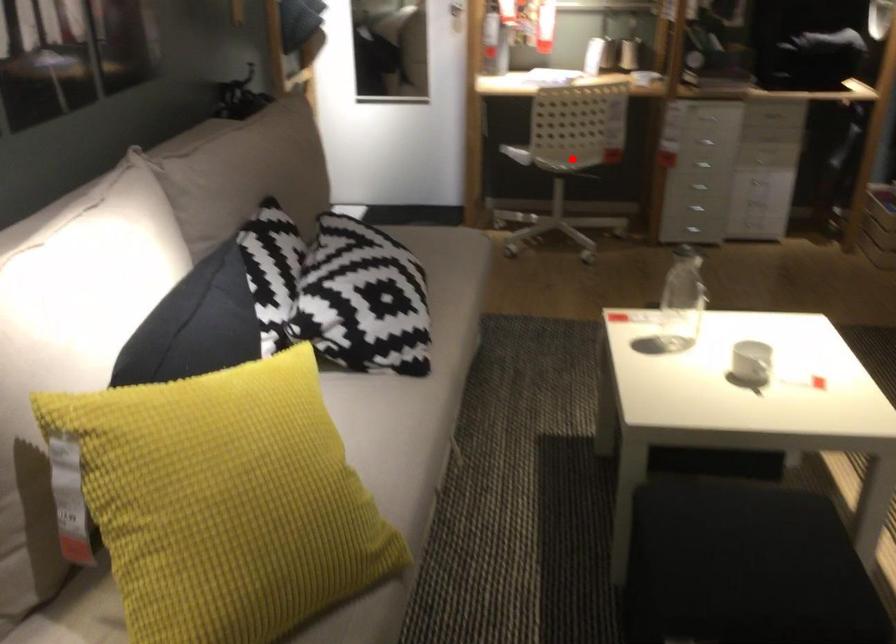
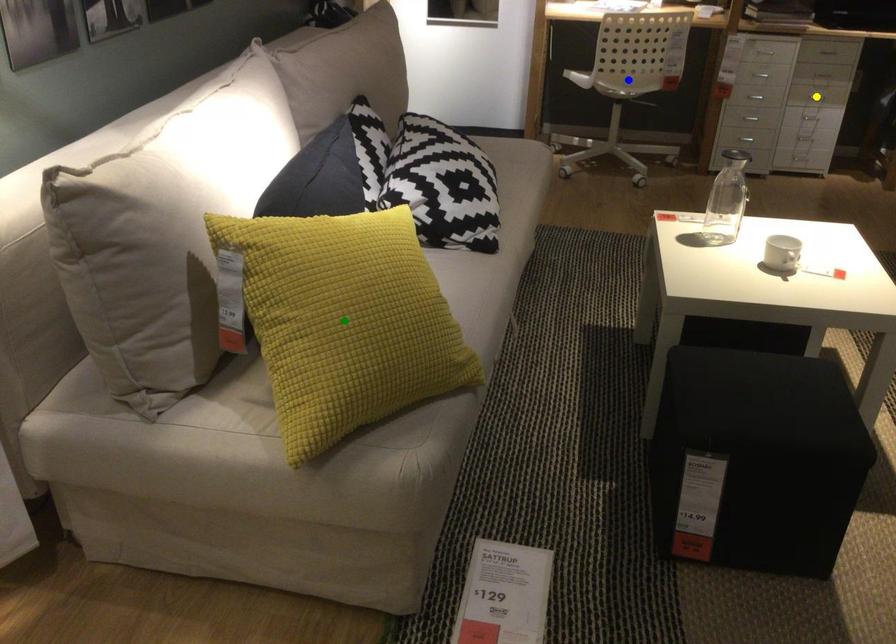
Question: I am providing you with two images of the same scene from different viewpoints. A red point is marked on the first image. You are given multiple points on the second image. Which spot in image 2 lines up with the point in image 1?

Choices:
 (A) green point
 (B) blue point
 (C) yellow point

Answer: (B)